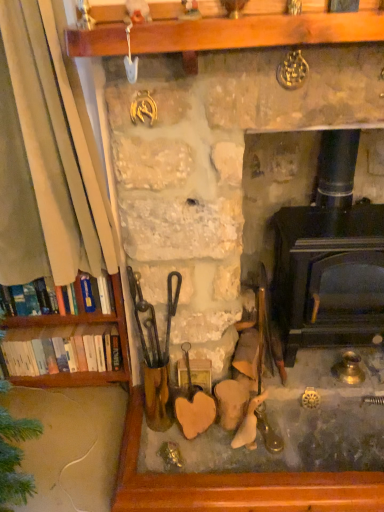
Question: Considering the relative sizes of stone fireplace at center and white paperbacks at left, positioned as the second book in front-to-back order, in the image provided, is stone fireplace at center smaller than white paperbacks at left, positioned as the second book in front-to-back order,?

Choices:
 (A) no
 (B) yes

Answer: (A)

Question: Can you confirm if stone fireplace at center is wider than white paperbacks at left, which ranks as the second book in top-to-bottom order?

Choices:
 (A) no
 (B) yes

Answer: (B)

Question: From the image's perspective, is stone fireplace at center beneath white paperbacks at left, the 1th book from the bottom?

Choices:
 (A) no
 (B) yes

Answer: (A)

Question: Is stone fireplace at center to the left of white paperbacks at left, positioned as the second book in front-to-back order, from the viewer's perspective?

Choices:
 (A) yes
 (B) no

Answer: (B)

Question: Is stone fireplace at center far away from white paperbacks at left, which ranks as the second book in top-to-bottom order?

Choices:
 (A) no
 (B) yes

Answer: (A)

Question: Is hardcover books at left, arranged as the 1th book when viewed from the front, inside or outside of black cast iron wood burning stove at center?

Choices:
 (A) outside
 (B) inside

Answer: (A)

Question: From the image's perspective, relative to black cast iron wood burning stove at center, is hardcover books at left, which is the 2th book from back to front, above or below?

Choices:
 (A) above
 (B) below

Answer: (B)

Question: In the image, is hardcover books at left, arranged as the 1th book when viewed from the front, positioned in front of or behind black cast iron wood burning stove at center?

Choices:
 (A) behind
 (B) front

Answer: (A)

Question: From a real-world perspective, relative to black cast iron wood burning stove at center, is hardcover books at left, which is the 2th book from back to front, vertically above or below?

Choices:
 (A) above
 (B) below

Answer: (A)

Question: Is stone fireplace at center to the left or to the right of white paperbacks at left, positioned as the second book in front-to-back order, in the image?

Choices:
 (A) left
 (B) right

Answer: (B)

Question: Considering their positions, is stone fireplace at center located in front of or behind white paperbacks at left, the 1th book from the bottom?

Choices:
 (A) front
 (B) behind

Answer: (A)

Question: Choose the correct answer: Is stone fireplace at center inside white paperbacks at left, positioned as the second book in front-to-back order, or outside it?

Choices:
 (A) outside
 (B) inside

Answer: (A)

Question: Is point (195, 247) closer or farther from the camera than point (51, 332)?

Choices:
 (A) farther
 (B) closer

Answer: (B)

Question: From a real-world perspective, is white paperbacks at left, which ranks as the second book in top-to-bottom order, above or below stone fireplace at center?

Choices:
 (A) above
 (B) below

Answer: (B)

Question: From their relative heights in the image, would you say white paperbacks at left, which ranks as the second book in top-to-bottom order, is taller or shorter than stone fireplace at center?

Choices:
 (A) short
 (B) tall

Answer: (A)